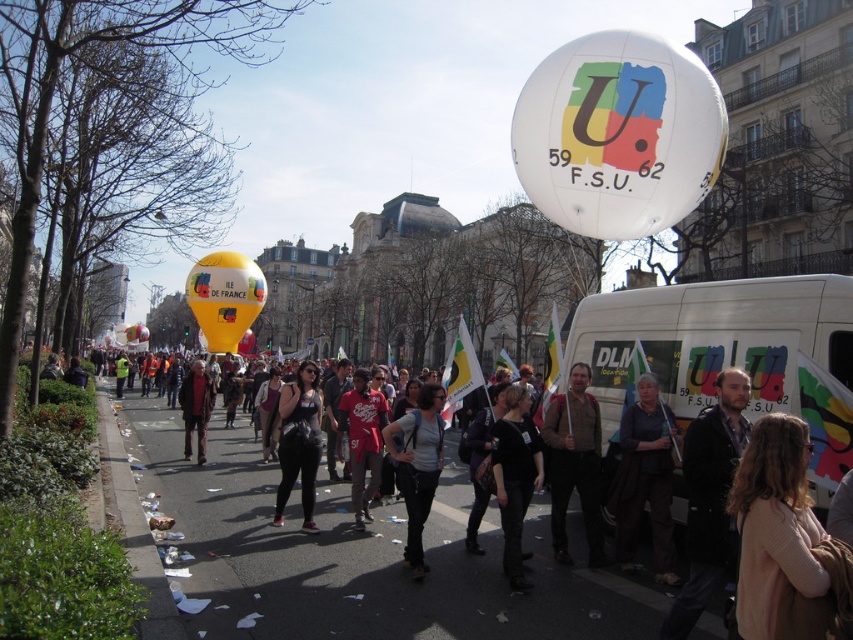
Question: Considering the relative positions of yellowmatteballoon at left and dark gray jacket at center in the image provided, where is yellowmatteballoon at left located with respect to dark gray jacket at center?

Choices:
 (A) right
 (B) left

Answer: (B)

Question: Observing the image, what is the correct spatial positioning of dark brown leather jacket at lower right in reference to black matte pants at center?

Choices:
 (A) below
 (B) above

Answer: (B)

Question: Which object is positioned closest to the yellowmatteballoon at left?

Choices:
 (A) yellowballoon at left
 (B) matte black jacket at center
 (C) light pink sweater at center
 (D) dark brown leather jacket at lower right

Answer: (B)

Question: Estimate the real-world distances between objects in this image. Which object is closer to the dark gray jacket at center?

Choices:
 (A) black matte pants at center
 (B) matte black jacket at center
 (C) red cotton shirt at center

Answer: (C)

Question: Which object is the farthest from the white matte van at center?

Choices:
 (A) dark gray jacket at center
 (B) red cotton shirt at center

Answer: (A)

Question: Can you confirm if light pink sweater at center is positioned to the left of red cotton shirt at center?

Choices:
 (A) yes
 (B) no

Answer: (B)